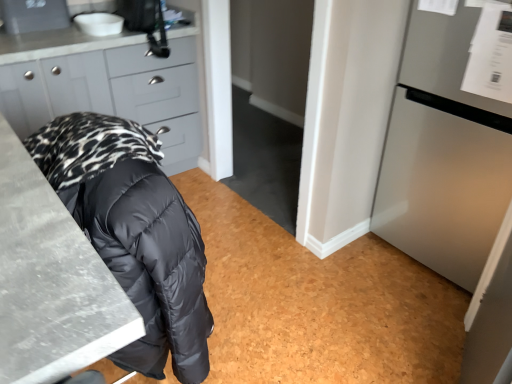
The height and width of the screenshot is (384, 512). Identify the location of free space to the right of matte gray cabinets at upper left. (245, 178).